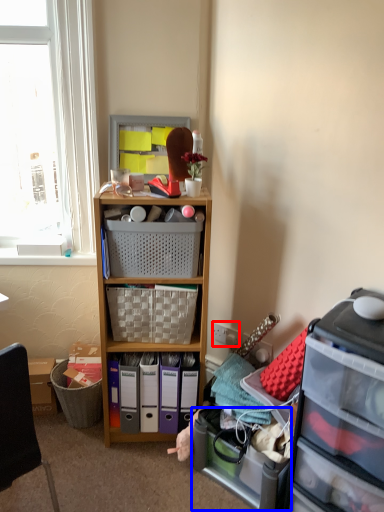
Question: Which of the following is the closest to the observer, power outlet (highlighted by a red box) or storage box (highlighted by a blue box)?

Choices:
 (A) power outlet
 (B) storage box

Answer: (B)